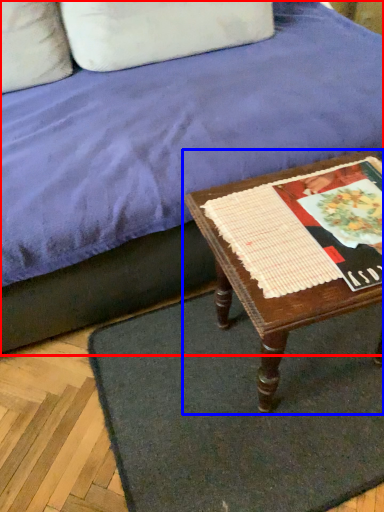
Question: Which of the following is the closest to the observer, studio couch (highlighted by a red box) or table (highlighted by a blue box)?

Choices:
 (A) studio couch
 (B) table

Answer: (A)